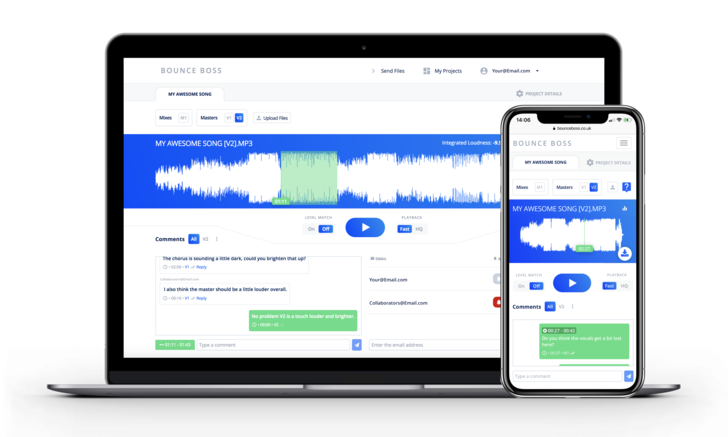
This screenshot has height=437, width=728. I want to click on phone screen, so click(546, 159), click(549, 299).